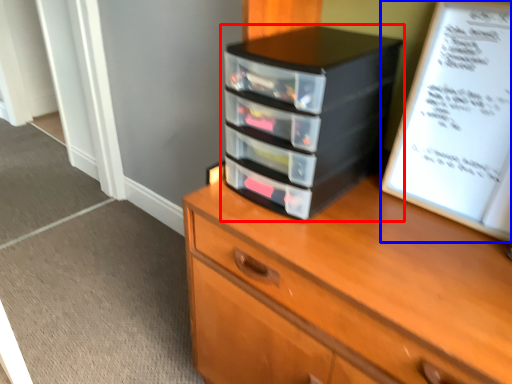
Question: Which of the following is the farthest to the observer, nightstand (highlighted by a red box) or paperback book (highlighted by a blue box)?

Choices:
 (A) nightstand
 (B) paperback book

Answer: (A)